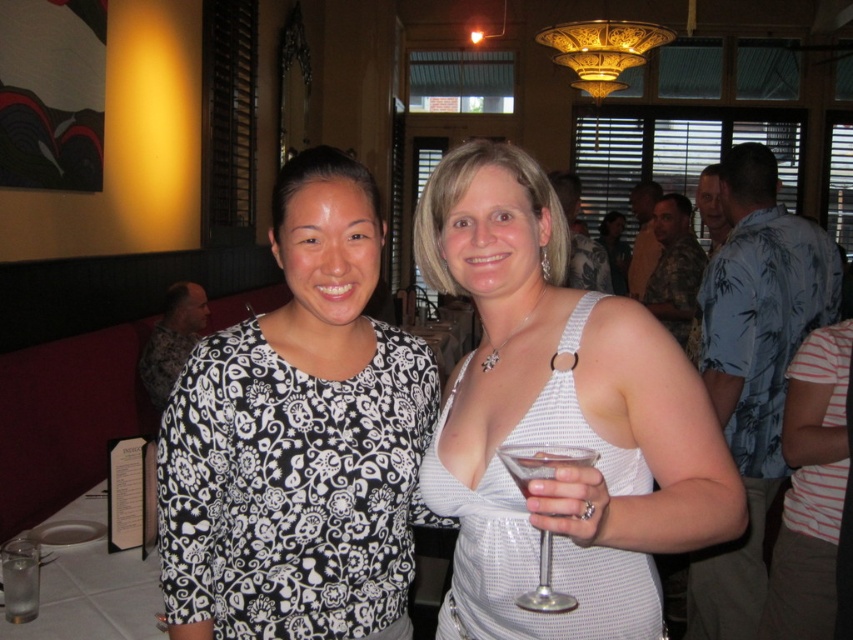
Between point (172, 522) and point (524, 483), which one is positioned in front?

Point (524, 483)

Looking at this image, who is more distant from viewer, (372, 483) or (570, 596)?

The point (372, 483) is behind.

Identify the location of black printed blouse at center. (299, 440).

Between white textured dress at center and clear glass at lower left, which one is positioned higher?

white textured dress at center

Does white textured dress at center appear on the right side of clear glass at lower left?

Indeed, white textured dress at center is positioned on the right side of clear glass at lower left.

Between point (596, 445) and point (28, 614), which one is positioned behind?

Positioned behind is point (28, 614).

Locate an element on the screen. The height and width of the screenshot is (640, 853). white textured dress at center is located at coordinates (558, 419).

Can you confirm if black printed blouse at center is shorter than clear glass at lower left?

No.

What do you see at coordinates (299, 440) in the screenshot? I see `black printed blouse at center` at bounding box center [299, 440].

Where is `black printed blouse at center`? The height and width of the screenshot is (640, 853). black printed blouse at center is located at coordinates (299, 440).